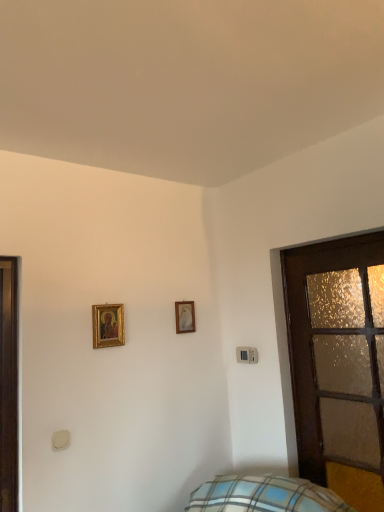
Consider the image. Measure the distance between gold-framed picture at upper left, placed as the 2th picture frame when sorted from back to front, and camera.

6.61 feet.

You are a GUI agent. You are given a task and a screenshot of the screen. Output one action in this format:
    pyautogui.click(x=<x>, y=<y>)
    Task: Click on the wooden frosted glass door at right
    
    Given the screenshot: What is the action you would take?
    pyautogui.click(x=333, y=354)

You are a GUI agent. You are given a task and a screenshot of the screen. Output one action in this format:
    pyautogui.click(x=<x>, y=<y>)
    Task: Click on the gold-framed picture at upper center, the 2th picture frame viewed from the front
    
    Given the screenshot: What is the action you would take?
    pyautogui.click(x=185, y=317)

Is gold-framed picture at upper left, which is the 1th picture frame from left to right, located outside gold-framed picture at upper center, the 2th picture frame viewed from the front?

That's correct, gold-framed picture at upper left, which is the 1th picture frame from left to right, is outside of gold-framed picture at upper center, the 2th picture frame viewed from the front.

From the image's perspective, is gold-framed picture at upper left, which is the 1th picture frame from left to right, located beneath gold-framed picture at upper center, which is counted as the first picture frame, starting from the back?

No.

Is the position of gold-framed picture at upper left, the first picture frame when ordered from front to back, less distant than that of gold-framed picture at upper center, which appears as the second picture frame when viewed from the left?

Yes, gold-framed picture at upper left, the first picture frame when ordered from front to back, is in front of gold-framed picture at upper center, which appears as the second picture frame when viewed from the left.

Can you confirm if gold-framed picture at upper left, which is the 1th picture frame from left to right, is bigger than wooden frosted glass door at right?

No, gold-framed picture at upper left, which is the 1th picture frame from left to right, is not bigger than wooden frosted glass door at right.

Considering the relative positions of gold-framed picture at upper left, placed as the 2th picture frame when sorted from back to front, and wooden frosted glass door at right in the image provided, is gold-framed picture at upper left, placed as the 2th picture frame when sorted from back to front, to the left of wooden frosted glass door at right from the viewer's perspective?

Yes, gold-framed picture at upper left, placed as the 2th picture frame when sorted from back to front, is to the left of wooden frosted glass door at right.

From a real-world perspective, which is physically below, gold-framed picture at upper left, the first picture frame when ordered from front to back, or wooden frosted glass door at right?

In real-world perspective, wooden frosted glass door at right is lower.

Who is bigger, wooden frosted glass door at right or gold-framed picture at upper center, the 1th picture frame in the right-to-left sequence?

With larger size is wooden frosted glass door at right.

Between wooden frosted glass door at right and gold-framed picture at upper center, the 2th picture frame viewed from the front, which one appears on the left side from the viewer's perspective?

gold-framed picture at upper center, the 2th picture frame viewed from the front, is more to the left.

Does point (305, 332) appear closer or farther from the camera than point (183, 306)?

Point (305, 332).

Can you confirm if wooden frosted glass door at right is shorter than gold-framed picture at upper center, which is counted as the first picture frame, starting from the back?

No, wooden frosted glass door at right is not shorter than gold-framed picture at upper center, which is counted as the first picture frame, starting from the back.

From a real-world perspective, between gold-framed picture at upper center, which is counted as the first picture frame, starting from the back, and gold-framed picture at upper left, the first picture frame when ordered from front to back, who is vertically lower?

gold-framed picture at upper left, the first picture frame when ordered from front to back, is physically lower.

Between gold-framed picture at upper center, which is counted as the first picture frame, starting from the back, and gold-framed picture at upper left, which is the 1th picture frame from left to right, which one has smaller size?

gold-framed picture at upper center, which is counted as the first picture frame, starting from the back.

Is gold-framed picture at upper center, the 2th picture frame viewed from the front, taller than gold-framed picture at upper left, placed as the 2th picture frame when sorted from back to front?

No, gold-framed picture at upper center, the 2th picture frame viewed from the front, is not taller than gold-framed picture at upper left, placed as the 2th picture frame when sorted from back to front.

Which object is closer to the camera, gold-framed picture at upper center, the 1th picture frame in the right-to-left sequence, or gold-framed picture at upper left, which is the 1th picture frame from left to right?

gold-framed picture at upper left, which is the 1th picture frame from left to right, is more forward.

Considering the positions of objects gold-framed picture at upper center, the 2th picture frame viewed from the front, and wooden frosted glass door at right in the image provided, who is in front, gold-framed picture at upper center, the 2th picture frame viewed from the front, or wooden frosted glass door at right?

wooden frosted glass door at right is more forward.

Starting from the wooden frosted glass door at right, which picture frame is the 1st one to the left? Please provide its 2D coordinates.

[(185, 317)]

In the scene shown: From the image's perspective, which one is positioned lower, gold-framed picture at upper center, the 2th picture frame viewed from the front, or wooden frosted glass door at right?

wooden frosted glass door at right is shown below in the image.

Measure the distance between gold-framed picture at upper center, which appears as the second picture frame when viewed from the left, and wooden frosted glass door at right.

gold-framed picture at upper center, which appears as the second picture frame when viewed from the left, and wooden frosted glass door at right are 30.46 inches apart.

What's the angular difference between wooden frosted glass door at right and gold-framed picture at upper left, the first picture frame when ordered from front to back,'s facing directions?

They differ by 89.9 degrees in their facing directions.

Does wooden frosted glass door at right have a larger size compared to gold-framed picture at upper left, which is the 1th picture frame from left to right?

Indeed, wooden frosted glass door at right has a larger size compared to gold-framed picture at upper left, which is the 1th picture frame from left to right.

Consider the image. Could gold-framed picture at upper left, placed as the 2th picture frame when sorted from back to front, be considered to be inside wooden frosted glass door at right?

No, gold-framed picture at upper left, placed as the 2th picture frame when sorted from back to front, is not inside wooden frosted glass door at right.

Is point (294, 403) closer to viewer compared to point (108, 346)?

No, (294, 403) is behind (108, 346).

The height and width of the screenshot is (512, 384). In order to click on picture frame on the right of the gold-framed picture at upper left, placed as the 2th picture frame when sorted from back to front in this screenshot , I will do `click(185, 317)`.

From a real-world perspective, which picture frame is the 1st one above the wooden frosted glass door at right? Please provide its 2D coordinates.

[(108, 325)]

Which object lies further to the anchor point gold-framed picture at upper left, the first picture frame when ordered from front to back, wooden frosted glass door at right or gold-framed picture at upper center, which appears as the second picture frame when viewed from the left?

Among the two, wooden frosted glass door at right is located further to gold-framed picture at upper left, the first picture frame when ordered from front to back.

From the image, which object appears to be nearer to gold-framed picture at upper center, the 2th picture frame viewed from the front, wooden frosted glass door at right or gold-framed picture at upper left, which is the 1th picture frame from left to right?

gold-framed picture at upper left, which is the 1th picture frame from left to right, lies closer to gold-framed picture at upper center, the 2th picture frame viewed from the front, than the other object.

Which object lies further to the anchor point wooden frosted glass door at right, gold-framed picture at upper center, the 1th picture frame in the right-to-left sequence, or gold-framed picture at upper left, which is the 1th picture frame from left to right?

Based on the image, gold-framed picture at upper left, which is the 1th picture frame from left to right, appears to be further to wooden frosted glass door at right.

Based on their spatial positions, is gold-framed picture at upper left, the 2th picture frame positioned from the right, or gold-framed picture at upper center, the 2th picture frame viewed from the front, closer to wooden frosted glass door at right?

gold-framed picture at upper center, the 2th picture frame viewed from the front, is positioned closer to the anchor wooden frosted glass door at right.

Estimate the real-world distances between objects in this image. Which object is further from gold-framed picture at upper left, the 2th picture frame positioned from the right, gold-framed picture at upper center, the 1th picture frame in the right-to-left sequence, or wooden frosted glass door at right?

wooden frosted glass door at right is positioned further to the anchor gold-framed picture at upper left, the 2th picture frame positioned from the right.

Based on their spatial positions, is gold-framed picture at upper left, placed as the 2th picture frame when sorted from back to front, or wooden frosted glass door at right further from gold-framed picture at upper center, the 1th picture frame in the right-to-left sequence?

wooden frosted glass door at right is positioned further to the anchor gold-framed picture at upper center, the 1th picture frame in the right-to-left sequence.

Identify the location of picture frame between gold-framed picture at upper left, placed as the 2th picture frame when sorted from back to front, and wooden frosted glass door at right from left to right. This screenshot has width=384, height=512. (185, 317).